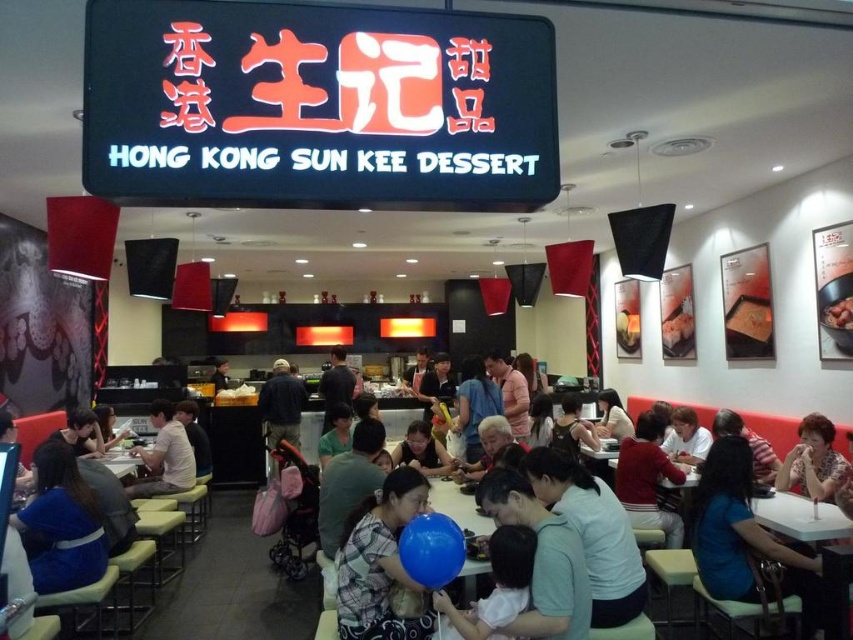
Between blue fabric shirt at lower right and white plastic table at lower left, which one has less height?

white plastic table at lower left

Is blue fabric shirt at lower right to the left of white plastic table at lower left from the viewer's perspective?

No, blue fabric shirt at lower right is not to the left of white plastic table at lower left.

Where is `blue fabric shirt at lower right`? blue fabric shirt at lower right is located at coordinates (743, 536).

Locate an element on the screen. The height and width of the screenshot is (640, 853). blue fabric shirt at lower right is located at coordinates (743, 536).

Consider the image. Which is more to the left, plaid fabric shirt at lower center or blue cotton shirt at lower left?

From the viewer's perspective, blue cotton shirt at lower left appears more on the left side.

Is point (361, 560) less distant than point (91, 492)?

Yes, point (361, 560) is closer to viewer.

This screenshot has height=640, width=853. Identify the location of plaid fabric shirt at lower center. (380, 563).

Between point (39, 499) and point (848, 317), which one is positioned in front?

Positioned in front is point (39, 499).

Identify the location of blue cotton shirt at lower left. The image size is (853, 640). [x=61, y=524].

Find the location of a particular element. This screenshot has height=640, width=853. blue cotton shirt at lower left is located at coordinates (61, 524).